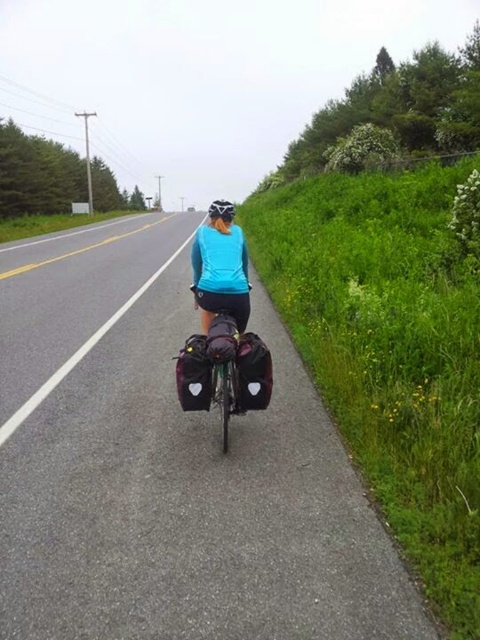
Question: Which of the following is the closest to the observer?

Choices:
 (A) (204, 317)
 (B) (308, 428)
 (C) (227, 212)

Answer: (B)

Question: Can you confirm if blue matte jacket at center is positioned below black matte bicycle helmet at upper center?

Choices:
 (A) no
 (B) yes

Answer: (A)

Question: Which object is closer to the camera taking this photo?

Choices:
 (A) black matte bicycle helmet at upper center
 (B) asphalt road at center

Answer: (B)

Question: Is asphalt road at center closer to the viewer compared to blue matte jacket at center?

Choices:
 (A) no
 (B) yes

Answer: (B)

Question: Which point is closer to the camera?

Choices:
 (A) (218, 214)
 (B) (28, 332)
 (C) (207, 240)

Answer: (C)

Question: Does blue matte jacket at center have a lesser width compared to black matte bicycle helmet at upper center?

Choices:
 (A) no
 (B) yes

Answer: (A)